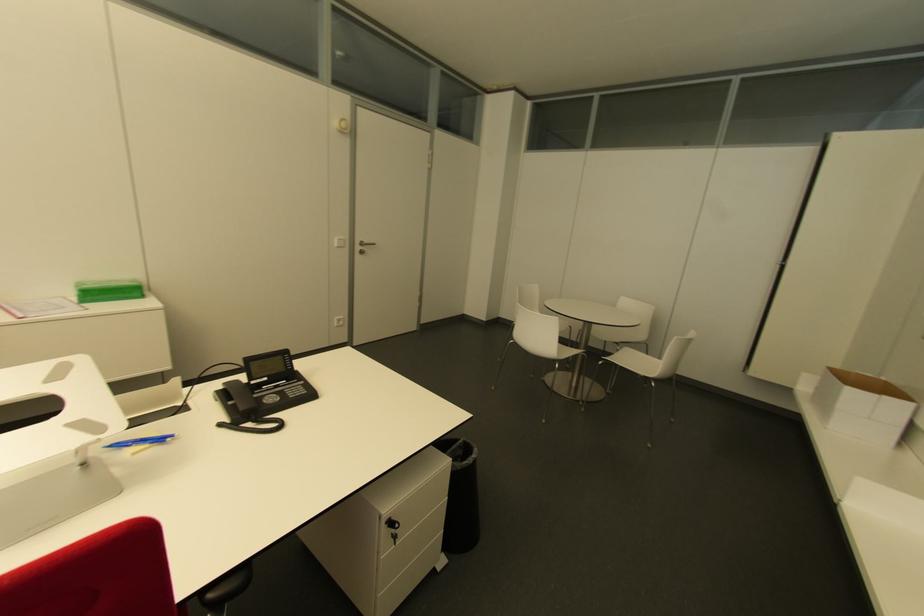
The height and width of the screenshot is (616, 924). I want to click on cabinet lock, so click(x=393, y=528).